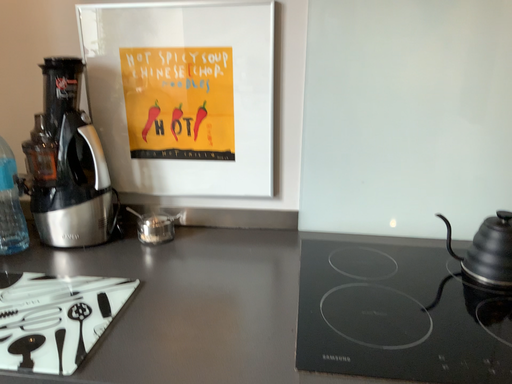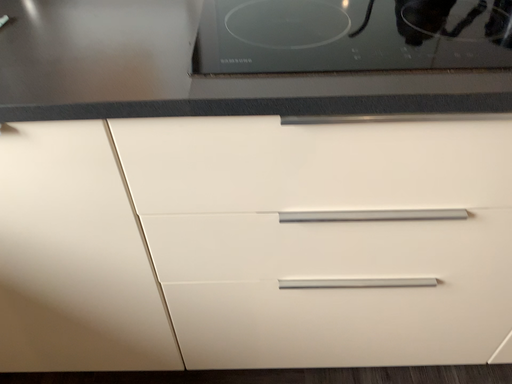
Question: How did the camera likely rotate when shooting the video?

Choices:
 (A) rotated upward
 (B) rotated downward

Answer: (B)